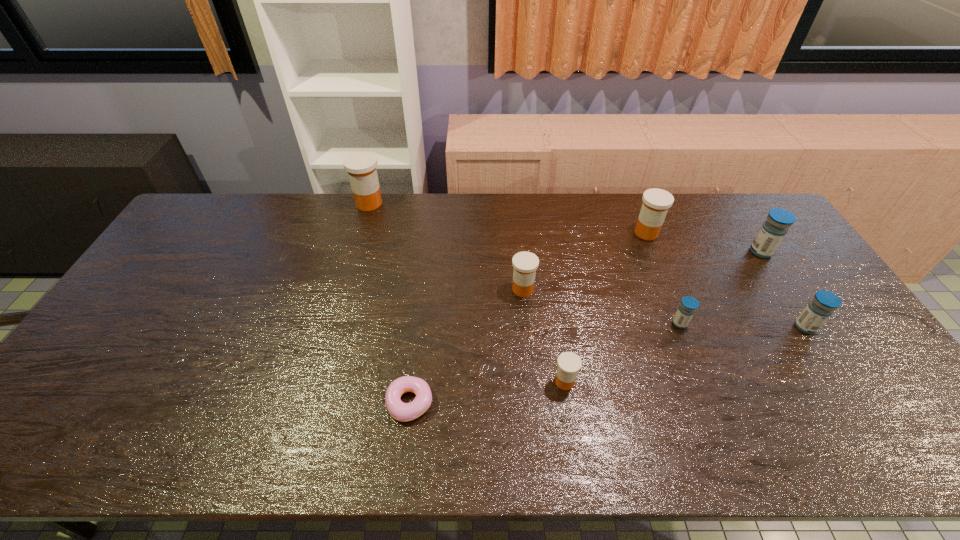
Image resolution: width=960 pixels, height=540 pixels. What are the coordinates of `vacant space located 0.280m on the back of the second biggest blue medicine` in the screenshot? It's located at (756, 252).

You are a GUI agent. You are given a task and a screenshot of the screen. Output one action in this format:
    pyautogui.click(x=<x>, y=<y>)
    Task: Click on the vacant space located on the front of the smallest blue medicine
    
    Given the screenshot: What is the action you would take?
    coord(721,426)

Locate an element on the screen. Image resolution: width=960 pixels, height=540 pixels. free space located on the label of the nearest orange medicine is located at coordinates [474, 382].

Locate an element on the screen. This screenshot has height=540, width=960. blank area located 0.050m on the label of the nearest orange medicine is located at coordinates (534, 382).

In order to click on vacant space situated on the label of the nearest orange medicine in this screenshot , I will do `click(402, 382)`.

Where is `vacant space located on the left of the seventh object from right to left`? vacant space located on the left of the seventh object from right to left is located at coordinates (361, 403).

Image resolution: width=960 pixels, height=540 pixels. In order to click on object positioned at the near edge in this screenshot , I will do `click(401, 411)`.

Find the location of a particular element. The width and height of the screenshot is (960, 540). free location at the far edge is located at coordinates (515, 216).

Locate an element on the screen. This screenshot has width=960, height=540. vacant space at the near edge of the desktop is located at coordinates (161, 453).

In the image, there is a desktop. Identify the location of free region at the left edge. (175, 287).